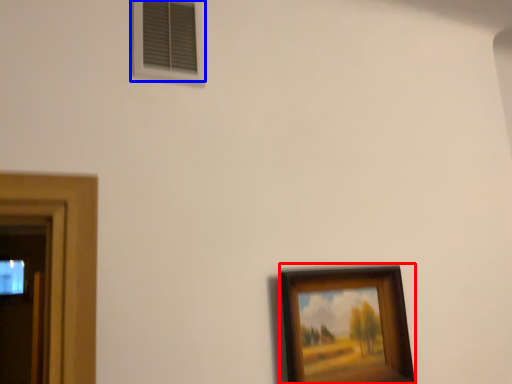
Question: Among these objects, which one is farthest to the camera, picture frame (highlighted by a red box) or window (highlighted by a blue box)?

Choices:
 (A) picture frame
 (B) window

Answer: (B)